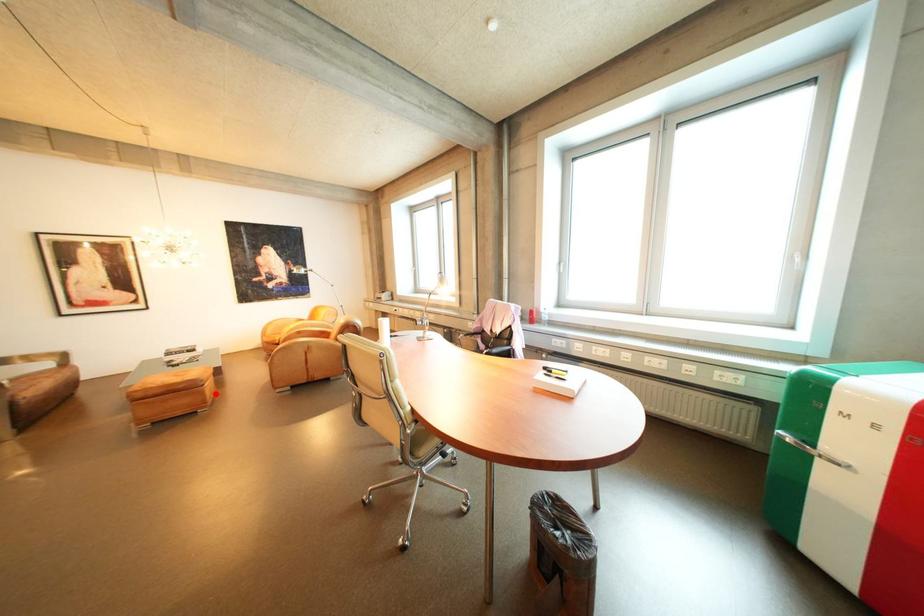
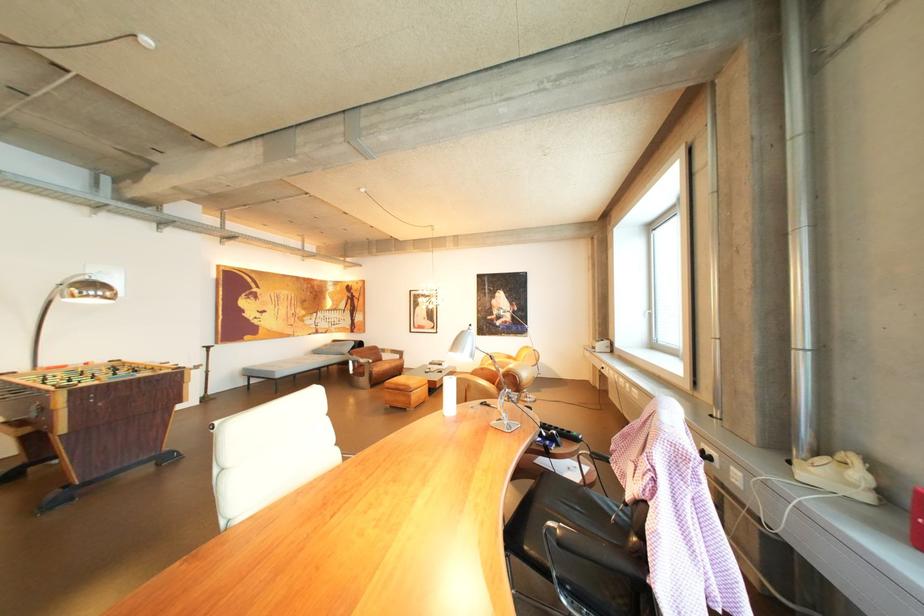
Where in the second image is the point corresponding to the highlighted location from the first image?

(422, 398)